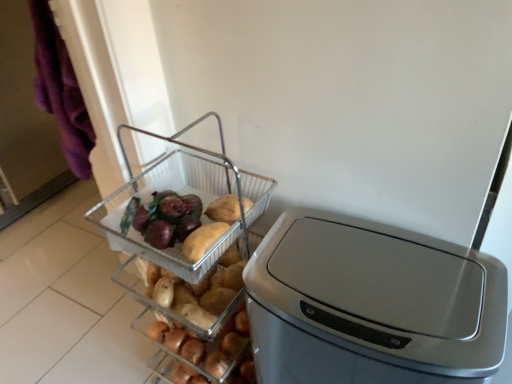
Question: Is clear plastic basket at center completely or partially inside satin silver trash can at center?

Choices:
 (A) no
 (B) yes

Answer: (A)

Question: Is satin silver trash can at center thinner than clear plastic basket at center?

Choices:
 (A) yes
 (B) no

Answer: (B)

Question: From the image's perspective, is satin silver trash can at center above clear plastic basket at center?

Choices:
 (A) yes
 (B) no

Answer: (B)

Question: Is satin silver trash can at center looking in the opposite direction of clear plastic basket at center?

Choices:
 (A) yes
 (B) no

Answer: (B)

Question: Considering the relative sizes of satin silver trash can at center and clear plastic basket at center in the image provided, is satin silver trash can at center shorter than clear plastic basket at center?

Choices:
 (A) no
 (B) yes

Answer: (A)

Question: Does satin silver trash can at center turn towards clear plastic basket at center?

Choices:
 (A) yes
 (B) no

Answer: (B)

Question: Considering the relative sizes of clear plastic basket at center and clear plastic basket at center in the image provided, is clear plastic basket at center bigger than clear plastic basket at center?

Choices:
 (A) no
 (B) yes

Answer: (B)

Question: Is clear plastic basket at center positioned beyond the bounds of clear plastic basket at center?

Choices:
 (A) no
 (B) yes

Answer: (B)

Question: Can you confirm if clear plastic basket at center is thinner than clear plastic basket at center?

Choices:
 (A) no
 (B) yes

Answer: (A)

Question: Is clear plastic basket at center at the left side of clear plastic basket at center?

Choices:
 (A) yes
 (B) no

Answer: (B)

Question: Can clear plastic basket at center be found inside clear plastic basket at center?

Choices:
 (A) yes
 (B) no

Answer: (A)

Question: Is clear plastic basket at center placed right next to clear plastic basket at center?

Choices:
 (A) yes
 (B) no

Answer: (A)

Question: Would you say clear plastic basket at center is a long distance from clear plastic basket at center?

Choices:
 (A) yes
 (B) no

Answer: (B)